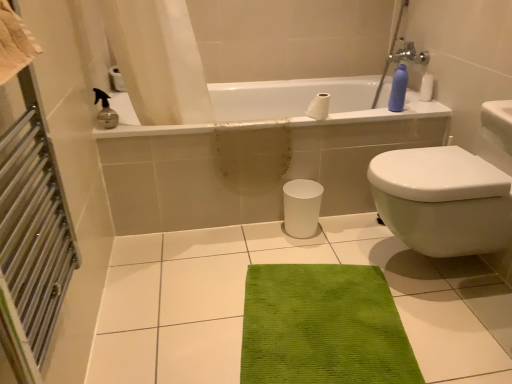
Question: Is white matte toilet paper at upper center located outside beige cotton towel at left?

Choices:
 (A) no
 (B) yes

Answer: (B)

Question: Considering the relative positions of white matte toilet paper at upper center and beige cotton towel at left in the image provided, is white matte toilet paper at upper center in front of beige cotton towel at left?

Choices:
 (A) no
 (B) yes

Answer: (A)

Question: Is white matte toilet paper at upper center aimed at beige cotton towel at left?

Choices:
 (A) yes
 (B) no

Answer: (B)

Question: From the image's perspective, is white matte toilet paper at upper center under beige cotton towel at left?

Choices:
 (A) no
 (B) yes

Answer: (A)

Question: Can you confirm if white matte toilet paper at upper center is taller than beige cotton towel at left?

Choices:
 (A) yes
 (B) no

Answer: (B)

Question: Is white glossy bidet at right taller or shorter than white glossy trash can at center?

Choices:
 (A) short
 (B) tall

Answer: (B)

Question: From a real-world perspective, is white glossy bidet at right above or below white glossy trash can at center?

Choices:
 (A) below
 (B) above

Answer: (B)

Question: From the image's perspective, is white glossy bidet at right above or below white glossy trash can at center?

Choices:
 (A) below
 (B) above

Answer: (B)

Question: Visually, is white glossy bidet at right positioned to the left or to the right of white glossy trash can at center?

Choices:
 (A) left
 (B) right

Answer: (B)

Question: In terms of height, does white glossy bidet at right look taller or shorter compared to white glossy bathtub at upper center?

Choices:
 (A) short
 (B) tall

Answer: (A)

Question: Is point (418, 238) closer or farther from the camera than point (175, 132)?

Choices:
 (A) farther
 (B) closer

Answer: (B)

Question: From the image's perspective, is white glossy bidet at right positioned above or below white glossy bathtub at upper center?

Choices:
 (A) below
 (B) above

Answer: (A)

Question: In terms of size, does white glossy bidet at right appear bigger or smaller than white glossy bathtub at upper center?

Choices:
 (A) big
 (B) small

Answer: (B)

Question: In terms of height, does beige cotton towel at left look taller or shorter compared to white glossy bathtub at upper center?

Choices:
 (A) short
 (B) tall

Answer: (A)

Question: From the image's perspective, is beige cotton towel at left above or below white glossy bathtub at upper center?

Choices:
 (A) above
 (B) below

Answer: (B)